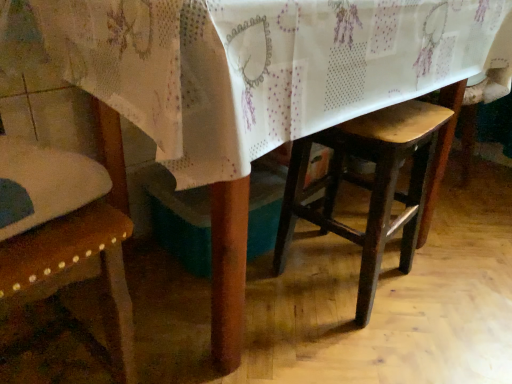
At what (x,y) coordinates should I click in order to perform the action: click on blank area beneath wooden chair at left (from a real-world perspective). Please return your answer as a coordinate pair (x, y). The width and height of the screenshot is (512, 384). Looking at the image, I should click on [45, 354].